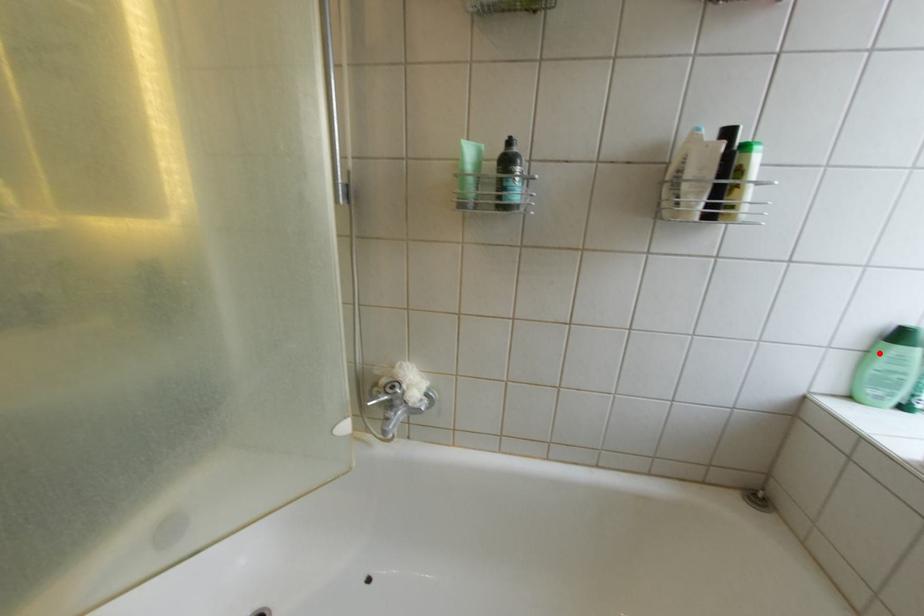
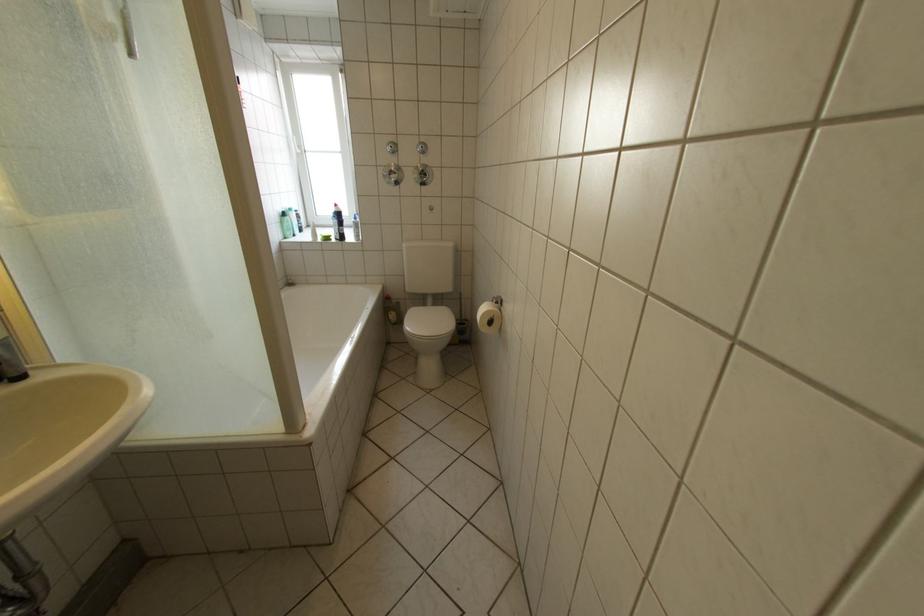
Question: I am providing you with two images of the same scene from different viewpoints. Given a red point in image1, look at the same physical point in image2. Is it:

Choices:
 (A) Closer to the viewpoint
 (B) Farther from the viewpoint

Answer: (A)